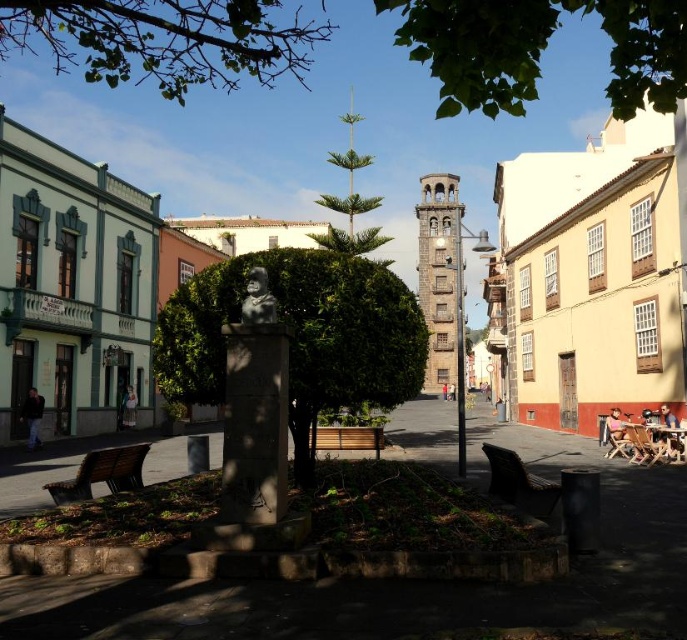
Question: Which point is closer to the camera taking this photo?

Choices:
 (A) (611, 413)
 (B) (43, 396)
 (C) (344, 368)
 (D) (133, 412)

Answer: (C)

Question: Does wooden bench at center appear under bronze statue at center?

Choices:
 (A) no
 (B) yes

Answer: (B)

Question: Is wooden bench at center below pink fabric chair at lower right?

Choices:
 (A) yes
 (B) no

Answer: (B)

Question: Which object is positioned closest to the wooden bench at center?

Choices:
 (A) light brown leather jacket at lower right
 (B) dark blue jeans at lower left

Answer: (A)

Question: Which object appears farthest from the camera in this image?

Choices:
 (A) wooden bench at lower left
 (B) wooden bench at lower right
 (C) green leafy tree at center

Answer: (A)

Question: Can you confirm if wooden bench at lower right is positioned to the right of dark blue jeans at lower left?

Choices:
 (A) yes
 (B) no

Answer: (A)